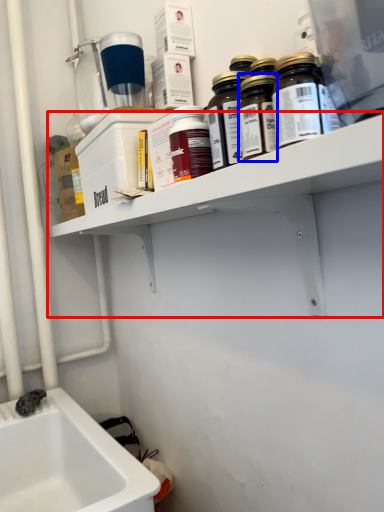
Question: Which of the following is the closest to the observer, shelf (highlighted by a red box) or bottle (highlighted by a blue box)?

Choices:
 (A) shelf
 (B) bottle

Answer: (A)